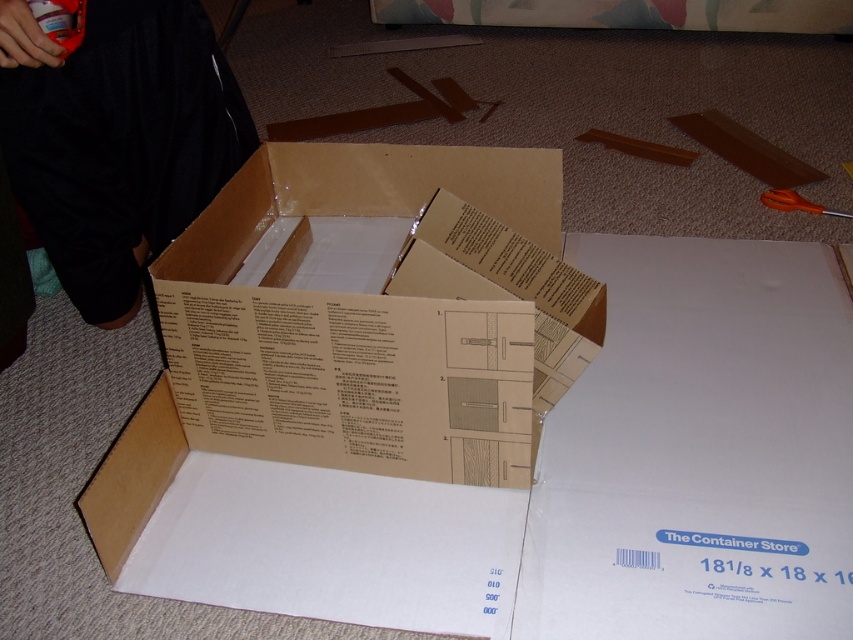
Question: Which point is closer to the camera taking this photo?

Choices:
 (A) (260, 428)
 (B) (770, 189)

Answer: (A)

Question: Which object appears farthest from the camera in this image?

Choices:
 (A) white cardboard at center
 (B) orange plastic scissors at center
 (C) brown cardboard box at center

Answer: (B)

Question: Does white cardboard at center lie in front of orange plastic scissors at center?

Choices:
 (A) yes
 (B) no

Answer: (A)

Question: Is brown cardboard box at center positioned in front of white cardboard at center?

Choices:
 (A) no
 (B) yes

Answer: (A)

Question: From the image, what is the correct spatial relationship of brown cardboard box at center in relation to white cardboard at center?

Choices:
 (A) right
 (B) left

Answer: (B)

Question: Which of the following is the farthest from the observer?

Choices:
 (A) white cardboard at center
 (B) brown cardboard box at center
 (C) orange plastic scissors at center

Answer: (C)